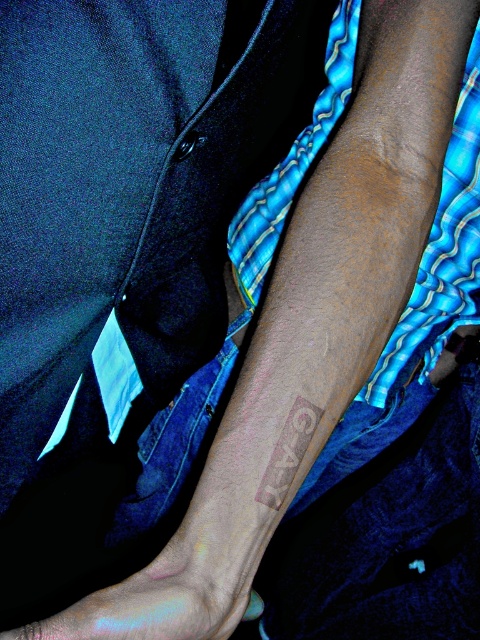
You are a fashion designer analyzing the placement of two points on a model wearing a dark blue shirt. The points are labeled as point 1 at coordinates point (298, 442) and point 2 at coordinates point (243, 614). From the viewer perspective, which point is closer to you?

Point 1 at coordinates point (298, 442) is closer to the viewer than point 2 at coordinates point (243, 614) because it is in front of it according to the spatial description provided.

You are a tattoo artist assessing the placement of a new tattoo. The client has a gray matte tattoo at lower center marked by point (288, 452). Where exactly on the arm should you place the new tattoo to ensure it aligns with the existing one?

The gray matte tattoo at lower center is located at point (288, 452), so the new tattoo should be placed near that coordinate to maintain alignment.

You are a tailor measuring the distance between the gray matte tattoo at lower center and the edge of the shirt collar. The tailor needs to ensure the tattoo is visible but not too close to the collar edge. If the minimum safe distance required is 30 centimeters, is the current distance sufficient?

The gray matte tattoo at lower center and viewer are 34.77 centimeters apart. Since 34.77 cm is greater than the required 30 cm, the current distance is sufficient.